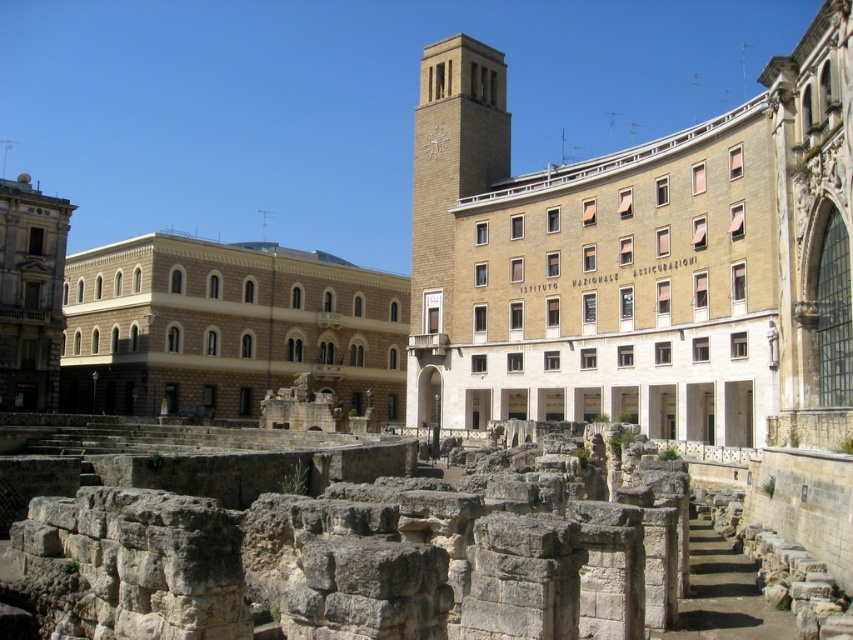
Which is above, brown stone amphitheater at center or beige stone clock tower at center?

Positioned higher is beige stone clock tower at center.

Does brown stone amphitheater at center have a lesser width compared to beige stone clock tower at center?

No.

Is point (335, 381) behind point (431, 164)?

Yes, it is behind point (431, 164).

Find the location of a particular element. This screenshot has height=640, width=853. brown stone amphitheater at center is located at coordinates (225, 326).